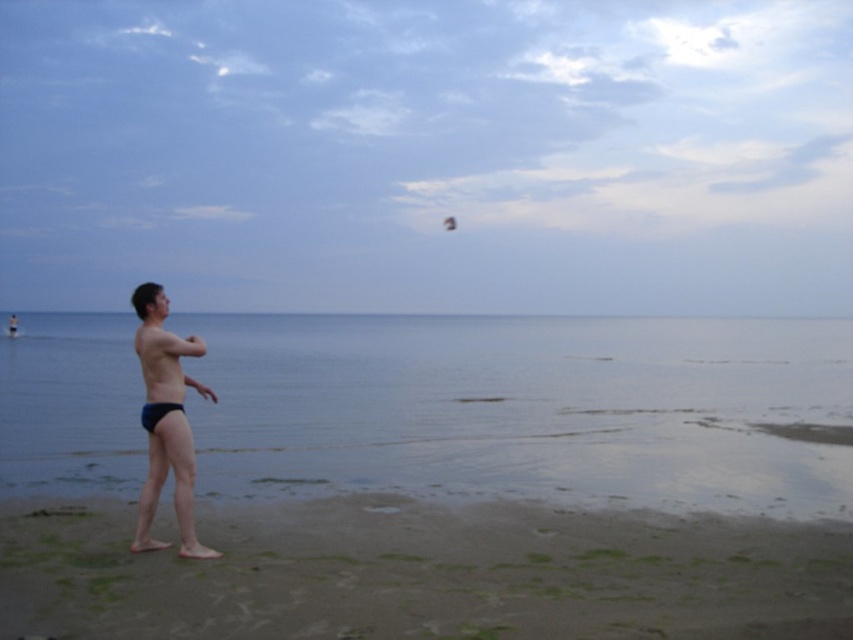
Between point (572, 340) and point (757, 568), which one is positioned behind?

Point (572, 340)

Between point (451, 417) and point (177, 620), which one is positioned in front?

Positioned in front is point (177, 620).

Where is `clear blue water at lower left`? This screenshot has width=853, height=640. clear blue water at lower left is located at coordinates (525, 408).

Does clear blue water at lower left appear over dark blue swim trunks at left?

Yes, clear blue water at lower left is above dark blue swim trunks at left.

Consider the image. Can you confirm if clear blue water at lower left is smaller than dark blue swim trunks at left?

Incorrect, clear blue water at lower left is not smaller in size than dark blue swim trunks at left.

What are the coordinates of `clear blue water at lower left` in the screenshot? It's located at (525, 408).

Between brown sandy beach at lower center and dark blue swim trunks at left, which one is positioned higher?

dark blue swim trunks at left

Who is more distant from viewer, (67, 545) or (183, 496)?

The point (67, 545) is more distant.

I want to click on brown sandy beach at lower center, so click(x=422, y=573).